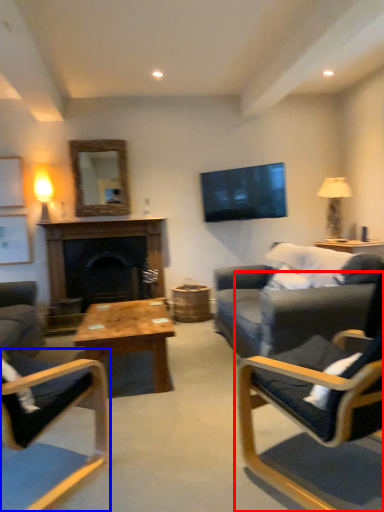
Question: Which point is closer to the camera, chair (highlighted by a red box) or chair (highlighted by a blue box)?

Choices:
 (A) chair
 (B) chair

Answer: (A)